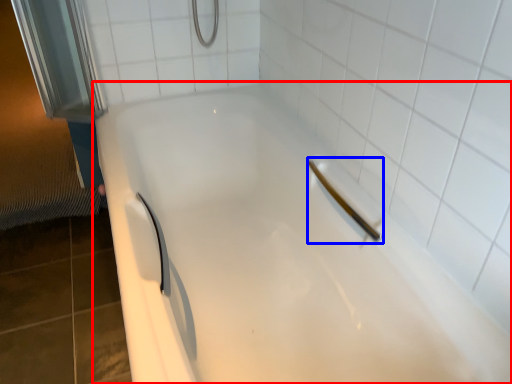
Question: Which of the following is the closest to the observer, bathtub (highlighted by a red box) or shower (highlighted by a blue box)?

Choices:
 (A) bathtub
 (B) shower

Answer: (A)